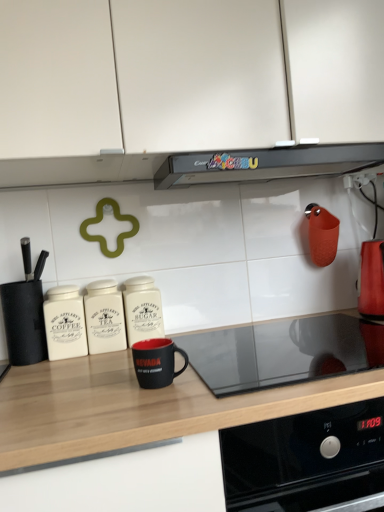
Identify the location of vacant region in front of black matte mug at center, the third kitchen appliance in the right-to-left sequence. The height and width of the screenshot is (512, 384). (144, 411).